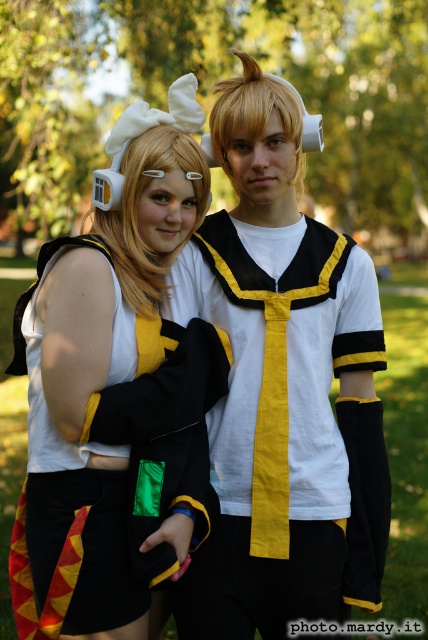
Can you confirm if matte black sailor uniform at center is positioned above matte black coat at center?

Incorrect, matte black sailor uniform at center is not positioned above matte black coat at center.

Does point (261, 182) come in front of point (130, 266)?

No, it is not.

Where is `matte black sailor uniform at center`? matte black sailor uniform at center is located at coordinates (287, 392).